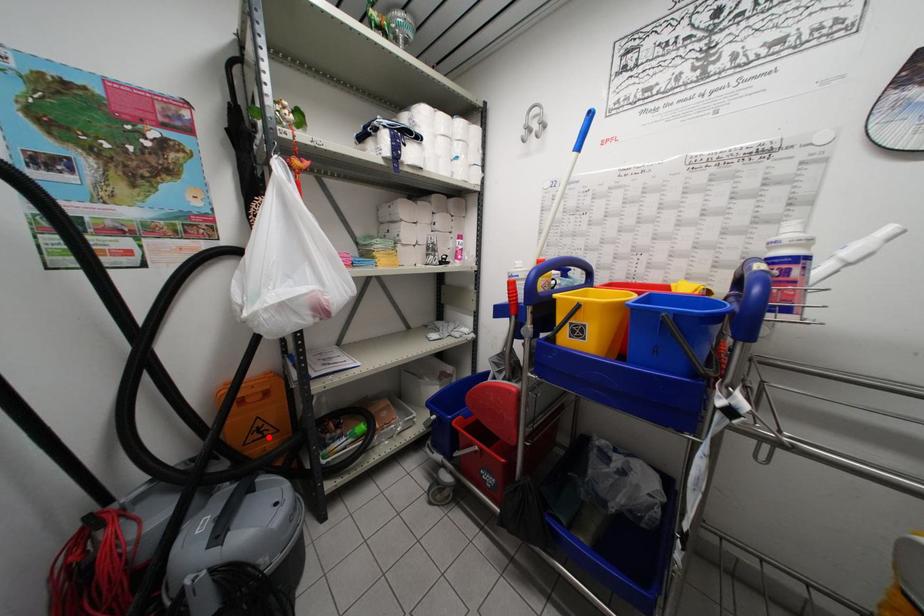
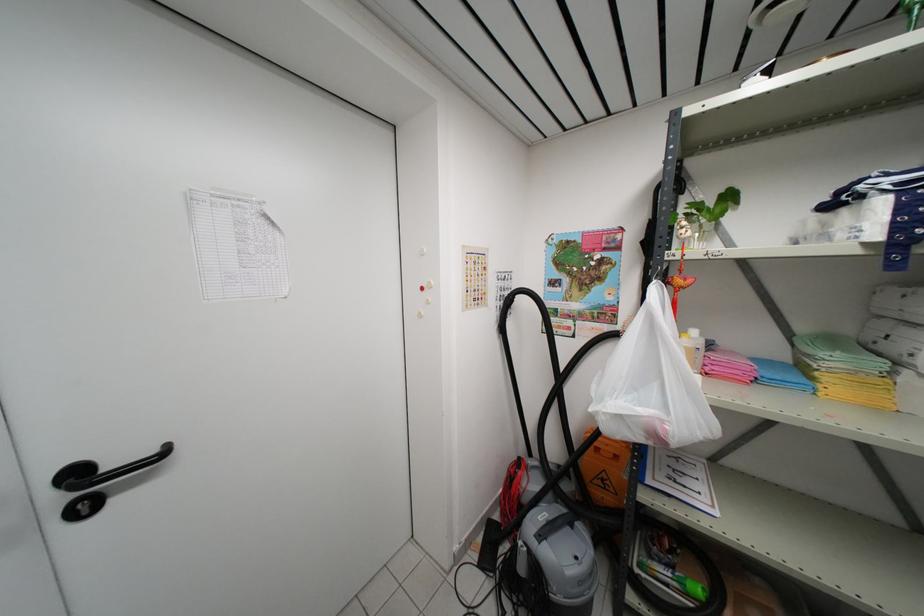
Question: I am providing you with two images of the same scene from different viewpoints. A red point is shown in image1. For the corresponding object point in image2, is it positioned nearer or farther from the camera?

Choices:
 (A) Nearer
 (B) Farther

Answer: (B)